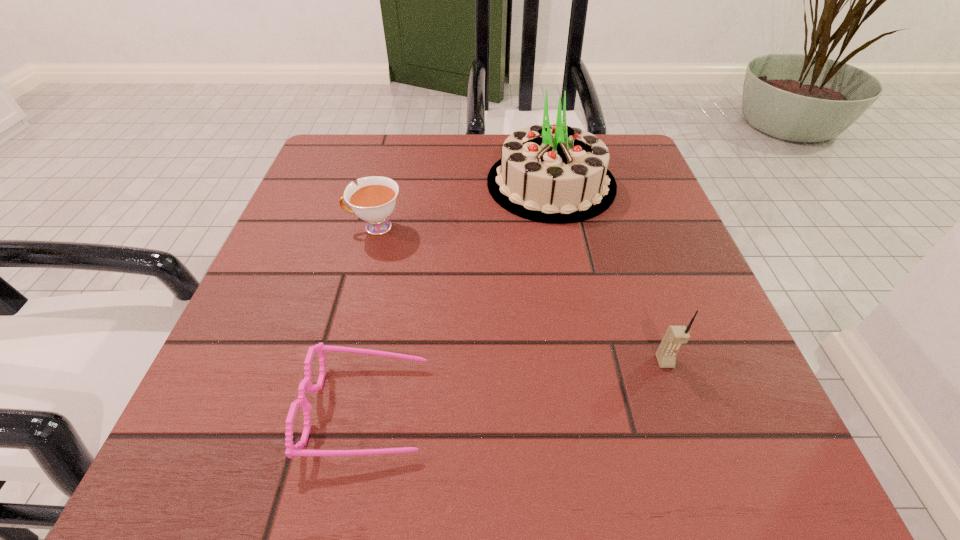
This screenshot has height=540, width=960. Identify the location of vacant space that's between the second shortest object and the shortest object. (372, 318).

Image resolution: width=960 pixels, height=540 pixels. What are the coordinates of `free spot between the tallest object and the spectacles` in the screenshot? It's located at (460, 296).

Find the location of `the closest object to the second tallest object`. the closest object to the second tallest object is located at coordinates (552, 173).

Locate an element on the screen. the closest object to the tallest object is located at coordinates (373, 200).

This screenshot has width=960, height=540. What are the coordinates of `free spot that satisfies the following two spatial constraints: 1. on the front of the cellular telephone, where the keypad is located; 2. on the arms of the shortest object` in the screenshot? It's located at (681, 408).